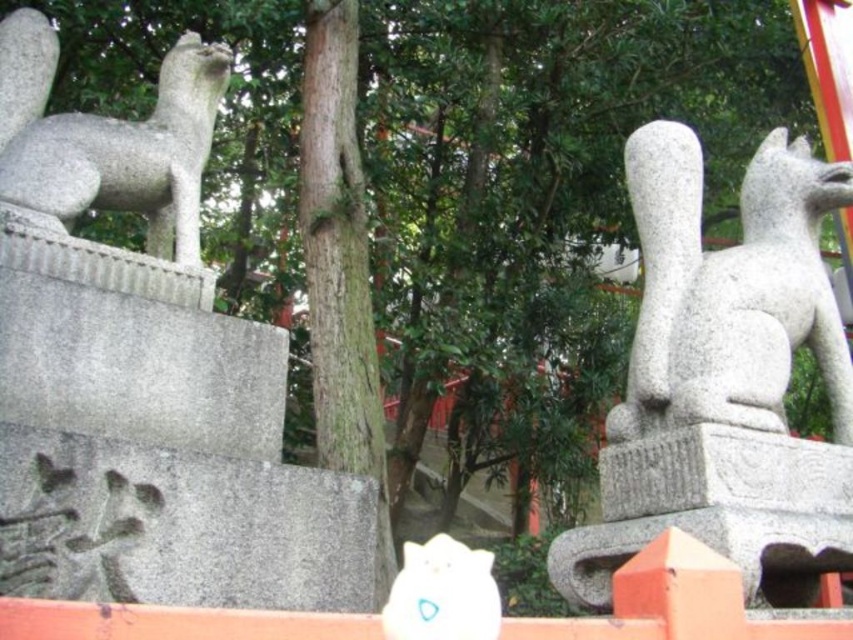
Question: Can you confirm if gray stone statue at left is positioned to the right of white plush toy at center?

Choices:
 (A) yes
 (B) no

Answer: (B)

Question: Among these points, which one is nearest to the camera?

Choices:
 (A) (804, 484)
 (B) (22, 84)

Answer: (A)

Question: Which point is closer to the camera?

Choices:
 (A) (392, 621)
 (B) (648, 284)
 (C) (167, 163)

Answer: (A)

Question: Does granite statue at right have a lesser width compared to gray stone statue at left?

Choices:
 (A) yes
 (B) no

Answer: (B)

Question: Observing the image, what is the correct spatial positioning of gray stone statue at left in reference to white plush toy at center?

Choices:
 (A) below
 (B) above

Answer: (B)

Question: Among these points, which one is farthest from the camera?

Choices:
 (A) (178, 38)
 (B) (427, 620)
 (C) (711, 257)

Answer: (A)